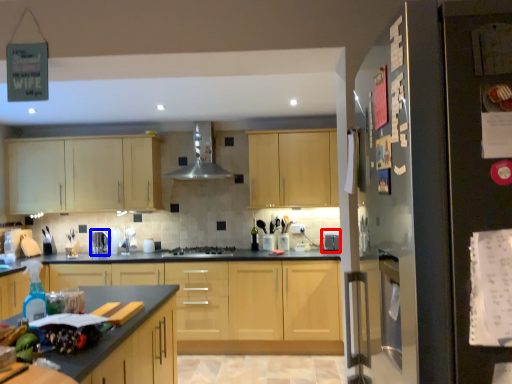
Question: Among these objects, which one is nearest to the camera, appliance (highlighted by a red box) or appliance (highlighted by a blue box)?

Choices:
 (A) appliance
 (B) appliance

Answer: (A)